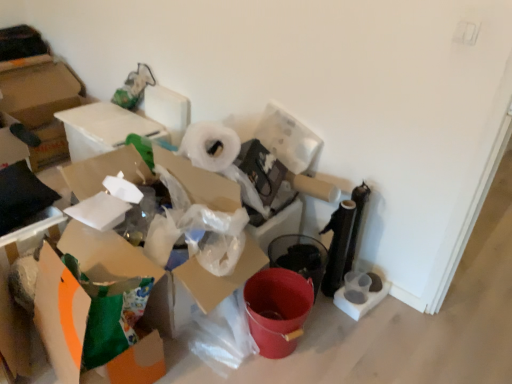
In order to click on free space in front of transparent plastic toilet paper at lower right in this screenshot , I will do `click(370, 330)`.